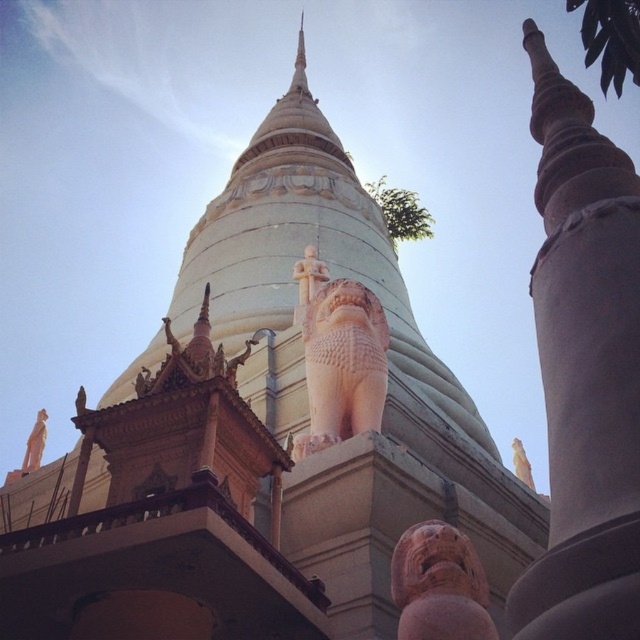
Question: Is smooth gray pillar at upper right thinner than white stone statue at lower left?

Choices:
 (A) yes
 (B) no

Answer: (A)

Question: Which of the following is the closest to the observer?

Choices:
 (A) smooth gray pillar at upper right
 (B) matte pink stone lion at lower right

Answer: (A)

Question: Is smooth gray pillar at upper right to the left of matte pink stone lion at lower right from the viewer's perspective?

Choices:
 (A) no
 (B) yes

Answer: (A)

Question: From the image, what is the correct spatial relationship of matte pink stone lion at center in relation to matte pink stone lion at lower right?

Choices:
 (A) below
 (B) above

Answer: (B)

Question: Which point is closer to the camera taking this photo?

Choices:
 (A) (317, 412)
 (B) (410, 600)
 (C) (44, 424)
 (D) (593, 429)

Answer: (D)

Question: Which point is farther to the camera?

Choices:
 (A) white stone statue at lower left
 (B) smooth gray pillar at upper right

Answer: (A)